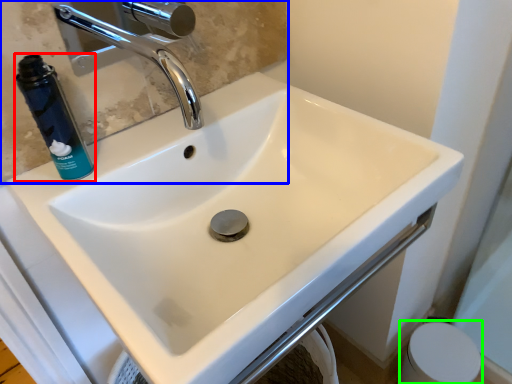
Question: Based on their relative distances, which object is farther from mouthwash (highlighted by a red box)? Choose from mirror (highlighted by a blue box) and toilet paper (highlighted by a green box).

Choices:
 (A) mirror
 (B) toilet paper

Answer: (B)